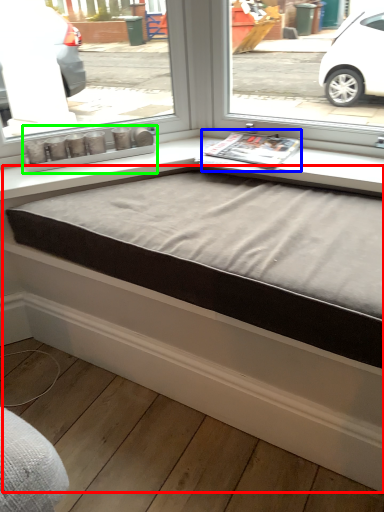
Question: Which object is positioned farthest from bed frame (highlighted by a red box)? Select from magazine (highlighted by a blue box) and window box (highlighted by a green box).

Choices:
 (A) magazine
 (B) window box

Answer: (B)